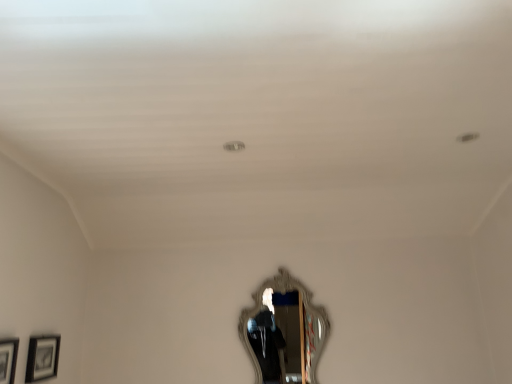
Locate an element on the screen. silver ornate mirror at center is located at coordinates (284, 332).

What is the approximate width of matte black picture frame at lower left, the 1th picture frame from the back?

The width of matte black picture frame at lower left, the 1th picture frame from the back, is 4.72 centimeters.

You are a GUI agent. You are given a task and a screenshot of the screen. Output one action in this format:
    pyautogui.click(x=<x>, y=<y>)
    Task: Click on the silver ornate mirror at center
    The height and width of the screenshot is (384, 512).
    Given the screenshot: What is the action you would take?
    pyautogui.click(x=284, y=332)

Based on the photo, from the image's perspective, which one is positioned lower, matte black picture frame at lower left, marked as the second picture frame in a front-to-back arrangement, or matte black picture frame at lower left, the first picture frame from the front?

matte black picture frame at lower left, marked as the second picture frame in a front-to-back arrangement, is shown below in the image.

Could you tell me if matte black picture frame at lower left, marked as the second picture frame in a front-to-back arrangement, is facing matte black picture frame at lower left, which is the 2th picture frame in back-to-front order?

No, matte black picture frame at lower left, marked as the second picture frame in a front-to-back arrangement, does not turn towards matte black picture frame at lower left, which is the 2th picture frame in back-to-front order.

Is point (54, 341) in front of point (10, 367)?

No, (54, 341) is behind (10, 367).

Considering the sizes of objects matte black picture frame at lower left, marked as the second picture frame in a front-to-back arrangement, and matte black picture frame at lower left, the first picture frame from the front, in the image provided, who is bigger, matte black picture frame at lower left, marked as the second picture frame in a front-to-back arrangement, or matte black picture frame at lower left, the first picture frame from the front,?

Bigger between the two is matte black picture frame at lower left, the first picture frame from the front.

Can you confirm if matte black picture frame at lower left, the 1th picture frame from the back, is wider than silver ornate mirror at center?

No, matte black picture frame at lower left, the 1th picture frame from the back, is not wider than silver ornate mirror at center.

Based on the photo, considering the sizes of matte black picture frame at lower left, marked as the second picture frame in a front-to-back arrangement, and silver ornate mirror at center in the image, is matte black picture frame at lower left, marked as the second picture frame in a front-to-back arrangement, taller or shorter than silver ornate mirror at center?

Considering their sizes, matte black picture frame at lower left, marked as the second picture frame in a front-to-back arrangement, has less height than silver ornate mirror at center.

Which is in front, matte black picture frame at lower left, marked as the second picture frame in a front-to-back arrangement, or silver ornate mirror at center?

matte black picture frame at lower left, marked as the second picture frame in a front-to-back arrangement, is in front.

Between matte black picture frame at lower left, which is the 2th picture frame in back-to-front order, and silver ornate mirror at center, which one has smaller width?

matte black picture frame at lower left, which is the 2th picture frame in back-to-front order.

Would you say matte black picture frame at lower left, which is the 2th picture frame in back-to-front order, is outside silver ornate mirror at center?

Yes.

Considering the positions of objects matte black picture frame at lower left, the first picture frame from the front, and silver ornate mirror at center in the image provided, who is in front, matte black picture frame at lower left, the first picture frame from the front, or silver ornate mirror at center?

Positioned in front is matte black picture frame at lower left, the first picture frame from the front.

At what (x,y) coordinates should I click in order to perform the action: click on mirror that is below the matte black picture frame at lower left, which is the 2th picture frame in back-to-front order (from the image's perspective). Please return your answer as a coordinate pair (x, y). This screenshot has width=512, height=384. Looking at the image, I should click on (284, 332).

Looking at this image, from a real-world perspective, between matte black picture frame at lower left, the first picture frame from the front, and matte black picture frame at lower left, the 1th picture frame from the back, who is vertically higher?

In real-world perspective, matte black picture frame at lower left, the 1th picture frame from the back, is above.

Considering the sizes of objects matte black picture frame at lower left, which is the 2th picture frame in back-to-front order, and matte black picture frame at lower left, marked as the second picture frame in a front-to-back arrangement, in the image provided, who is taller, matte black picture frame at lower left, which is the 2th picture frame in back-to-front order, or matte black picture frame at lower left, marked as the second picture frame in a front-to-back arrangement,?

With more height is matte black picture frame at lower left, which is the 2th picture frame in back-to-front order.

How different are the orientations of matte black picture frame at lower left, the first picture frame from the front, and matte black picture frame at lower left, the 1th picture frame from the back, in degrees?

They differ by 0.0342 degrees in their facing directions.

Would you say matte black picture frame at lower left, which is the 2th picture frame in back-to-front order, is part of silver ornate mirror at center's contents?

No, silver ornate mirror at center does not contain matte black picture frame at lower left, which is the 2th picture frame in back-to-front order.

Is silver ornate mirror at center to the right of matte black picture frame at lower left, the first picture frame from the front, from the viewer's perspective?

Indeed, silver ornate mirror at center is positioned on the right side of matte black picture frame at lower left, the first picture frame from the front.

Where is `mirror below the matte black picture frame at lower left, the first picture frame from the front (from the image's perspective)`? This screenshot has height=384, width=512. mirror below the matte black picture frame at lower left, the first picture frame from the front (from the image's perspective) is located at coordinates (284, 332).

From the image's perspective, would you say silver ornate mirror at center is shown under matte black picture frame at lower left, the first picture frame from the front?

Yes, from the image's perspective, silver ornate mirror at center is beneath matte black picture frame at lower left, the first picture frame from the front.

Is silver ornate mirror at center facing away from matte black picture frame at lower left, marked as the second picture frame in a front-to-back arrangement?

No.

Who is smaller, silver ornate mirror at center or matte black picture frame at lower left, the 1th picture frame from the back?

matte black picture frame at lower left, the 1th picture frame from the back, is smaller.

Is silver ornate mirror at center thinner than matte black picture frame at lower left, the 1th picture frame from the back?

In fact, silver ornate mirror at center might be wider than matte black picture frame at lower left, the 1th picture frame from the back.

At what (x,y) coordinates should I click in order to perform the action: click on picture frame located below the matte black picture frame at lower left, which is the 2th picture frame in back-to-front order (from the image's perspective). Please return your answer as a coordinate pair (x, y). The width and height of the screenshot is (512, 384). Looking at the image, I should click on tap(42, 358).

Locate an element on the screen. Image resolution: width=512 pixels, height=384 pixels. mirror on the right of matte black picture frame at lower left, the 1th picture frame from the back is located at coordinates (284, 332).

Considering their positions, is matte black picture frame at lower left, the 1th picture frame from the back, positioned further to matte black picture frame at lower left, which is the 2th picture frame in back-to-front order, than silver ornate mirror at center?

Among the two, silver ornate mirror at center is located further to matte black picture frame at lower left, which is the 2th picture frame in back-to-front order.

Which object lies further to the anchor point silver ornate mirror at center, matte black picture frame at lower left, the first picture frame from the front, or matte black picture frame at lower left, marked as the second picture frame in a front-to-back arrangement?

The object further to silver ornate mirror at center is matte black picture frame at lower left, the first picture frame from the front.

Which object lies further to the anchor point matte black picture frame at lower left, which is the 2th picture frame in back-to-front order, silver ornate mirror at center or matte black picture frame at lower left, the 1th picture frame from the back?

silver ornate mirror at center lies further to matte black picture frame at lower left, which is the 2th picture frame in back-to-front order, than the other object.

Looking at this image, based on their spatial positions, is silver ornate mirror at center or matte black picture frame at lower left, the first picture frame from the front, closer to matte black picture frame at lower left, the 1th picture frame from the back?

The object closer to matte black picture frame at lower left, the 1th picture frame from the back, is matte black picture frame at lower left, the first picture frame from the front.

Which object lies further to the anchor point silver ornate mirror at center, matte black picture frame at lower left, the 1th picture frame from the back, or matte black picture frame at lower left, which is the 2th picture frame in back-to-front order?

matte black picture frame at lower left, which is the 2th picture frame in back-to-front order, is further to silver ornate mirror at center.

From the picture: Estimate the real-world distances between objects in this image. Which object is further from matte black picture frame at lower left, the 1th picture frame from the back, matte black picture frame at lower left, which is the 2th picture frame in back-to-front order, or silver ornate mirror at center?

silver ornate mirror at center.

At what (x,y) coordinates should I click in order to perform the action: click on picture frame between matte black picture frame at lower left, the 1th picture frame from the back, and silver ornate mirror at center from left to right. Please return your answer as a coordinate pair (x, y). The width and height of the screenshot is (512, 384). Looking at the image, I should click on (8, 359).